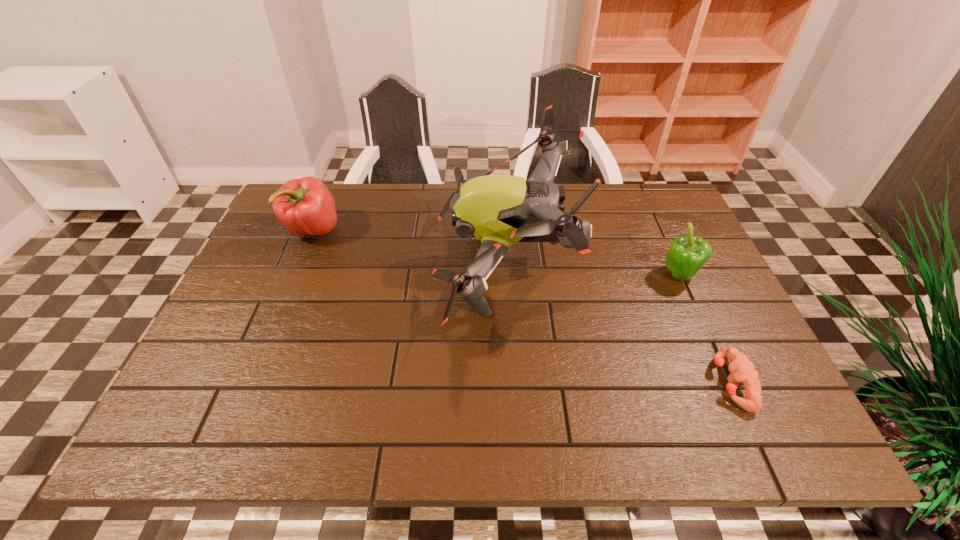
Find the location of a particular element. vacant region between the puncher and the farther bell pepper is located at coordinates (521, 307).

Image resolution: width=960 pixels, height=540 pixels. In order to click on vacant area that lies between the farther bell pepper and the second object from left to right in this screenshot , I will do `click(408, 246)`.

The width and height of the screenshot is (960, 540). In order to click on free space between the shortest object and the second object from left to right in this screenshot , I will do `click(617, 322)`.

You are a GUI agent. You are given a task and a screenshot of the screen. Output one action in this format:
    pyautogui.click(x=<x>, y=<y>)
    Task: Click on the free point between the nearer bell pepper and the second object from left to right
    The height and width of the screenshot is (540, 960).
    Given the screenshot: What is the action you would take?
    pyautogui.click(x=591, y=269)

Where is `object that is the closest to the shortest object`? The image size is (960, 540). object that is the closest to the shortest object is located at coordinates (687, 254).

The height and width of the screenshot is (540, 960). Identify the location of object that stands as the second closest to the farther bell pepper. (687, 254).

This screenshot has width=960, height=540. In order to click on free location that satisfies the following two spatial constraints: 1. on the back side of the nearer bell pepper; 2. on the front-facing side of the drone in this screenshot , I will do `click(673, 261)`.